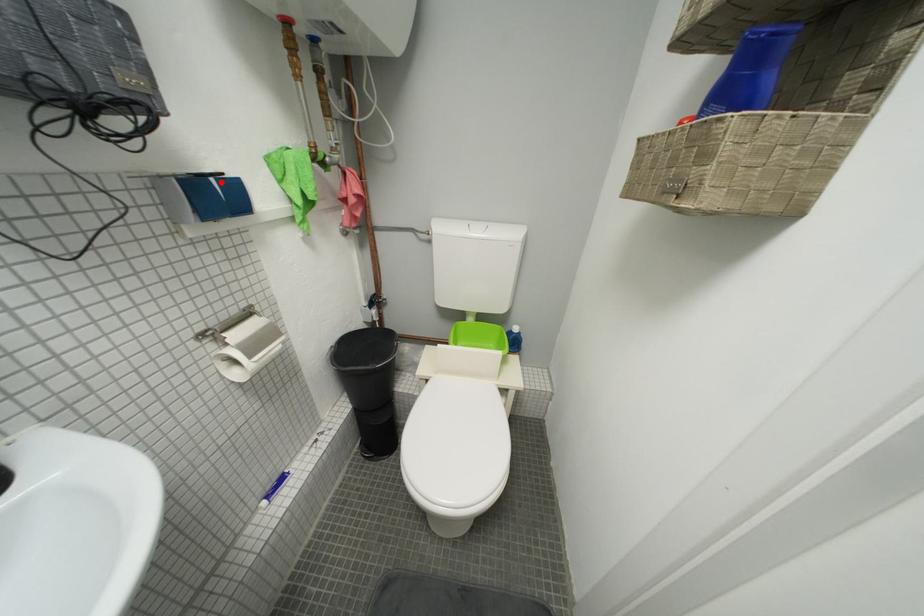
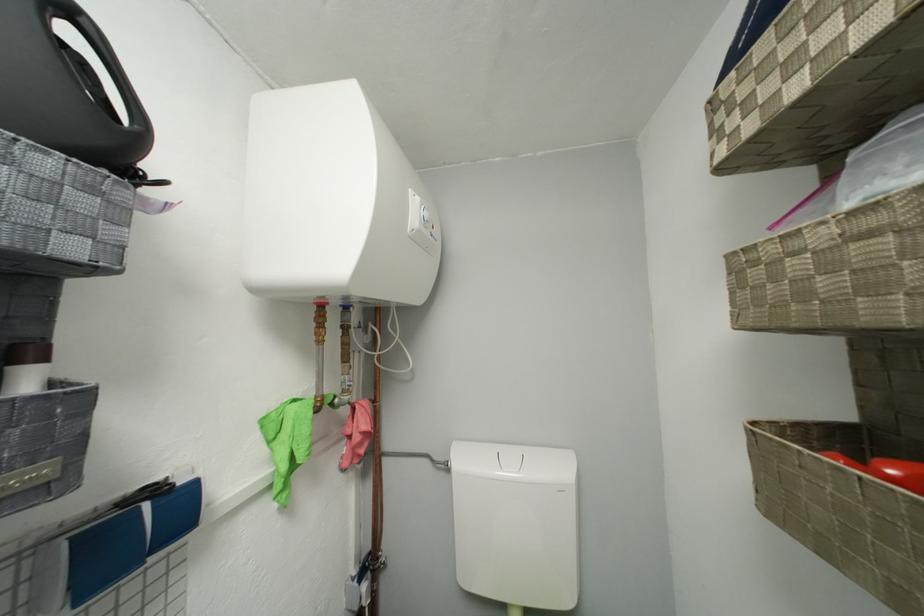
Question: I am providing you with two images of the same scene from different viewpoints. A red point is marked on the first image. At the location where the point appears in image 1, is it still visible in image 2?

Choices:
 (A) Yes
 (B) No

Answer: (A)